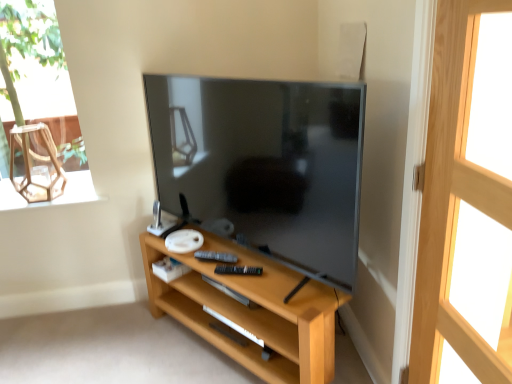
This screenshot has width=512, height=384. Find the location of `vacant space underneath matte black tv at center (from a real-world perspective)`. vacant space underneath matte black tv at center (from a real-world perspective) is located at coordinates (260, 276).